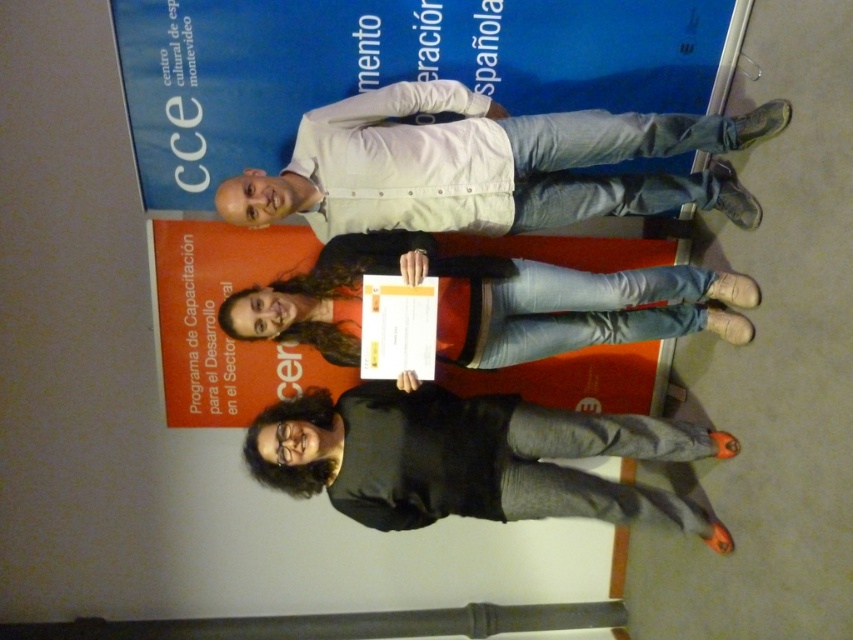
Question: Is black matte shirt at center closer to camera compared to denim jeans at center?

Choices:
 (A) yes
 (B) no

Answer: (B)

Question: Which is farther from the blue paper at upper center?

Choices:
 (A) black matte shirt at center
 (B) white cotton shirt at center

Answer: (A)

Question: Does blue paper at upper center appear under white cotton shirt at center?

Choices:
 (A) yes
 (B) no

Answer: (B)

Question: Which object is positioned closest to the denim jeans at center?

Choices:
 (A) blue paper at upper center
 (B) white cotton shirt at center

Answer: (B)

Question: Which object is positioned farthest from the denim jeans at center?

Choices:
 (A) blue paper at upper center
 (B) white cotton shirt at center
 (C) black matte shirt at center

Answer: (A)

Question: Is white cotton shirt at center wider than black matte shirt at center?

Choices:
 (A) no
 (B) yes

Answer: (A)